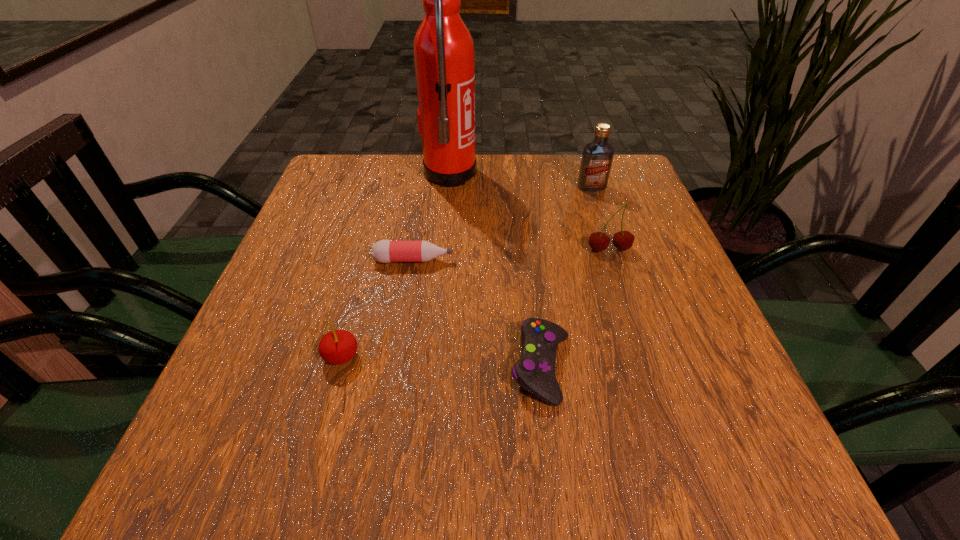
The height and width of the screenshot is (540, 960). Find the location of `free space between the bottle and the third object from right to left`. free space between the bottle and the third object from right to left is located at coordinates (477, 314).

You are a GUI agent. You are given a task and a screenshot of the screen. Output one action in this format:
    pyautogui.click(x=<x>, y=<y>)
    Task: Click on the free space between the control and the vodka
    The height and width of the screenshot is (540, 960).
    Given the screenshot: What is the action you would take?
    pyautogui.click(x=566, y=277)

Find the location of `vacant area that lies between the fourth object from left to right and the farther cherry`. vacant area that lies between the fourth object from left to right and the farther cherry is located at coordinates (575, 308).

This screenshot has width=960, height=540. In order to click on free point between the fifth shortest object and the bottle in this screenshot , I will do `click(502, 224)`.

Where is `the fourth closest object to the fire extinguisher`? the fourth closest object to the fire extinguisher is located at coordinates (535, 370).

Locate which object ranks second in proximity to the bottle. Please provide its 2D coordinates. Your answer should be formatted as a tuple, i.e. [(x, y)], where the tuple contains the x and y coordinates of a point satisfying the conditions above.

[(535, 370)]